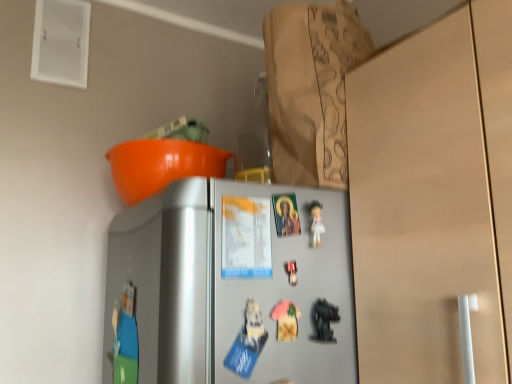
Question: Considering the relative sizes of pink fabric magnet at center, the first toy in the left-to-right sequence, and metallic silver toy at center, which is counted as the 2th toy, starting from the right, in the image provided, is pink fabric magnet at center, the first toy in the left-to-right sequence, smaller than metallic silver toy at center, which is counted as the 2th toy, starting from the right,?

Choices:
 (A) no
 (B) yes

Answer: (A)

Question: Does pink fabric magnet at center, the first toy in the left-to-right sequence, have a lesser height compared to metallic silver toy at center, which is counted as the 2th toy, starting from the right?

Choices:
 (A) no
 (B) yes

Answer: (A)

Question: Can you confirm if pink fabric magnet at center, the first toy in the left-to-right sequence, is thinner than metallic silver toy at center, which is counted as the 2th toy, starting from the right?

Choices:
 (A) yes
 (B) no

Answer: (B)

Question: Is pink fabric magnet at center, acting as the third toy starting from the right, positioned with its back to metallic silver toy at center, the second toy from the left?

Choices:
 (A) no
 (B) yes

Answer: (A)

Question: Is pink fabric magnet at center, the first toy in the left-to-right sequence, outside metallic silver toy at center, which is counted as the 2th toy, starting from the right?

Choices:
 (A) no
 (B) yes

Answer: (B)

Question: Would you say metallic black toy at lower right, the first toy from the right, is to the left or to the right of pink fabric magnet at center, acting as the third toy starting from the right, in the picture?

Choices:
 (A) left
 (B) right

Answer: (B)

Question: Considering the positions of point (327, 304) and point (289, 324), is point (327, 304) closer or farther from the camera than point (289, 324)?

Choices:
 (A) closer
 (B) farther

Answer: (B)

Question: Is metallic black toy at lower right, arranged as the 3th toy when viewed from the left, wider or thinner than pink fabric magnet at center, acting as the third toy starting from the right?

Choices:
 (A) thin
 (B) wide

Answer: (B)

Question: Considering the positions of metallic black toy at lower right, the first toy from the right, and pink fabric magnet at center, the first toy in the left-to-right sequence, in the image, is metallic black toy at lower right, the first toy from the right, taller or shorter than pink fabric magnet at center, the first toy in the left-to-right sequence,?

Choices:
 (A) short
 (B) tall

Answer: (B)

Question: From the image's perspective, is brown paper bag at upper center above or below metallic silver toy at center, the second toy from the left?

Choices:
 (A) below
 (B) above

Answer: (B)

Question: Considering the positions of point (317, 54) and point (290, 263), is point (317, 54) closer or farther from the camera than point (290, 263)?

Choices:
 (A) closer
 (B) farther

Answer: (B)

Question: Would you say brown paper bag at upper center is to the left or to the right of metallic silver toy at center, the second toy from the left, in the picture?

Choices:
 (A) right
 (B) left

Answer: (A)

Question: Relative to metallic silver toy at center, the second toy from the left, is brown paper bag at upper center in front or behind?

Choices:
 (A) front
 (B) behind

Answer: (B)

Question: Does point (325, 334) appear closer or farther from the camera than point (287, 263)?

Choices:
 (A) closer
 (B) farther

Answer: (B)

Question: Considering their positions, is metallic black toy at lower right, the first toy from the right, located in front of or behind metallic silver toy at center, the second toy from the left?

Choices:
 (A) front
 (B) behind

Answer: (A)